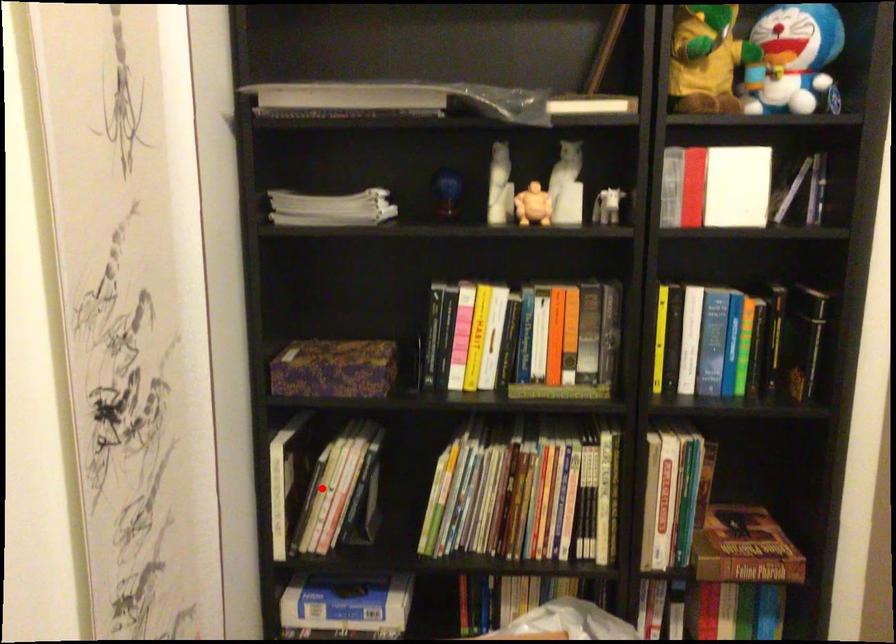
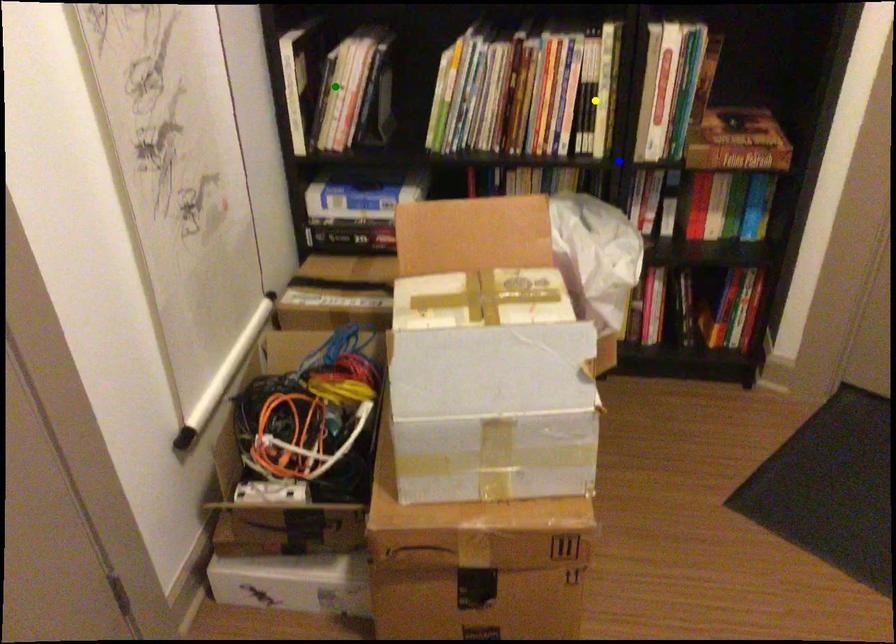
Question: I am providing you with two images of the same scene from different viewpoints. A red point is marked on the first image. You are given multiple points on the second image. Which point in image 2 is actually the same real-world point as the red point in image 1?

Choices:
 (A) green point
 (B) blue point
 (C) yellow point

Answer: (A)